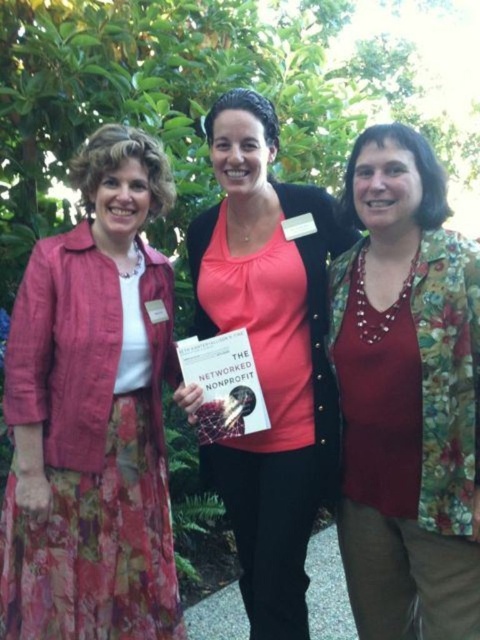
Question: Estimate the real-world distances between objects in this image. Which object is farther from the pink fabric shirt at center?

Choices:
 (A) floral fabric blouse at center
 (B) matte pink jacket at left

Answer: (B)

Question: In this image, where is floral fabric blouse at center located relative to pink fabric shirt at center?

Choices:
 (A) below
 (B) above

Answer: (A)

Question: Is matte pink jacket at left positioned before floral fabric blouse at center?

Choices:
 (A) yes
 (B) no

Answer: (B)

Question: From the image, what is the correct spatial relationship of floral fabric blouse at center in relation to pink fabric shirt at center?

Choices:
 (A) above
 (B) below

Answer: (B)

Question: Which point is farther to the camera?

Choices:
 (A) (344, 426)
 (B) (247, 227)

Answer: (B)

Question: Among these objects, which one is nearest to the camera?

Choices:
 (A) matte pink jacket at left
 (B) floral fabric blouse at center
 (C) pink fabric shirt at center

Answer: (B)